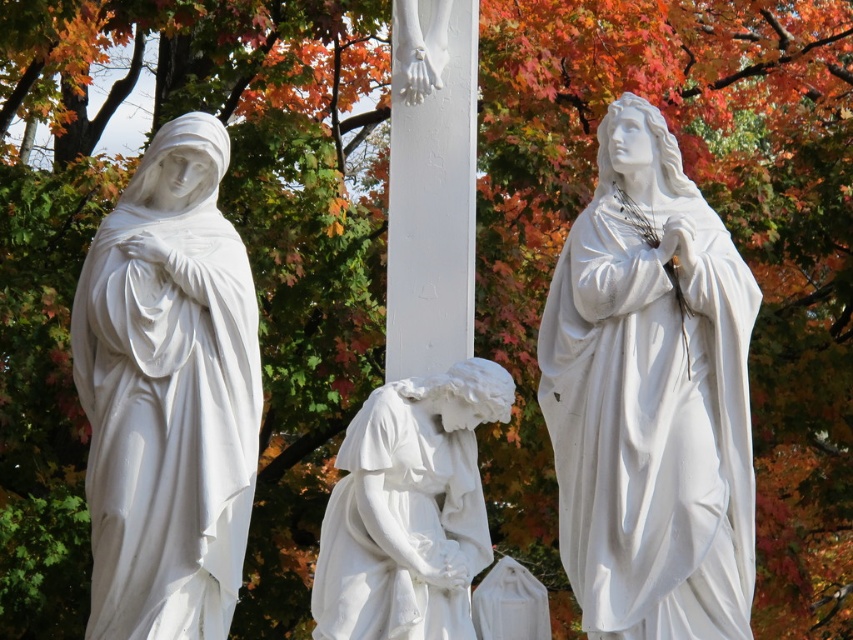
You are an art curator planning to move the white marble statue at left and the white marble statue at center to a new exhibition space. If you want to maintain their original spatial relationship as seen in the image, which statue should be placed closer to the entrance so that it appears in front of the other?

The white marble statue at left should be placed closer to the entrance because it was originally in front of the white marble statue at center, so positioning it nearer to the entrance will preserve that spatial relationship.

You are standing in front of the three statues. You want to move from the white marble statue at left to the white marble statue at right. Which direction should you move in?

The white marble statue at right is to the right of the white marble statue at left, so you should move to the right to reach it.